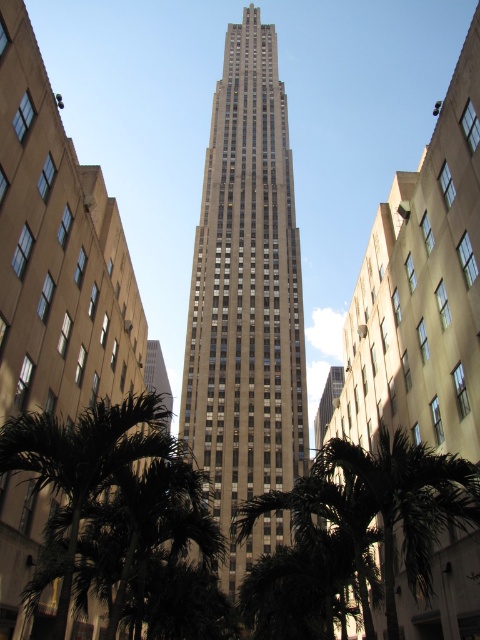
Question: Does gray stone skyscraper at center have a greater width compared to green leafy palm tree at lower left?

Choices:
 (A) no
 (B) yes

Answer: (B)

Question: Which object appears closest to the camera in this image?

Choices:
 (A) green leafy palm tree at center
 (B) gray stone skyscraper at center
 (C) green leafy palm tree at lower left

Answer: (C)

Question: Is gray stone skyscraper at center below green leafy palm tree at lower left?

Choices:
 (A) yes
 (B) no

Answer: (B)

Question: Can you confirm if gray stone skyscraper at center is positioned below green leafy palm tree at center?

Choices:
 (A) no
 (B) yes

Answer: (A)

Question: Among these points, which one is farthest from the camera?

Choices:
 (A) 216,444
 (B) 431,452

Answer: (A)

Question: Which of these objects is positioned closest to the green leafy palm tree at lower left?

Choices:
 (A) green leafy palm tree at center
 (B) gray stone skyscraper at center

Answer: (A)